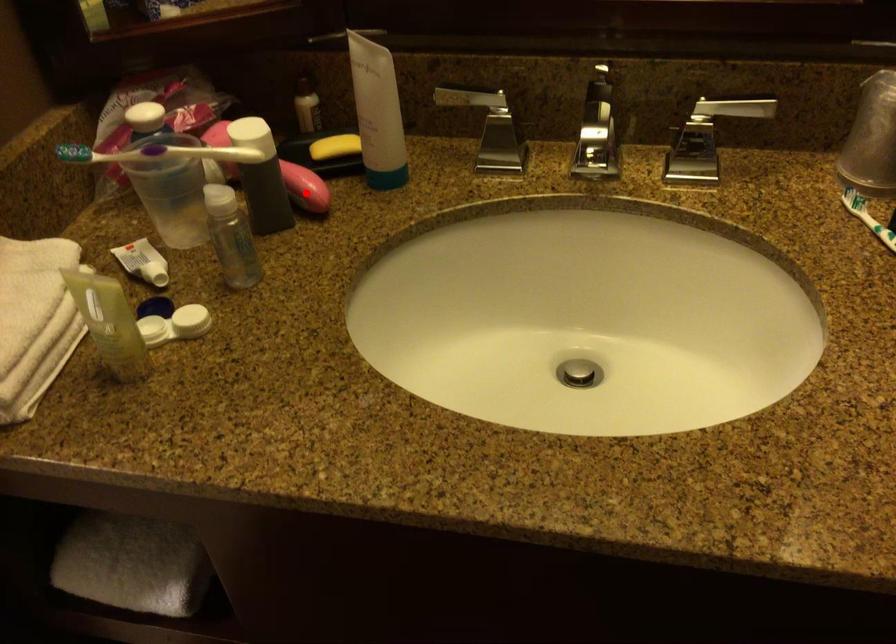
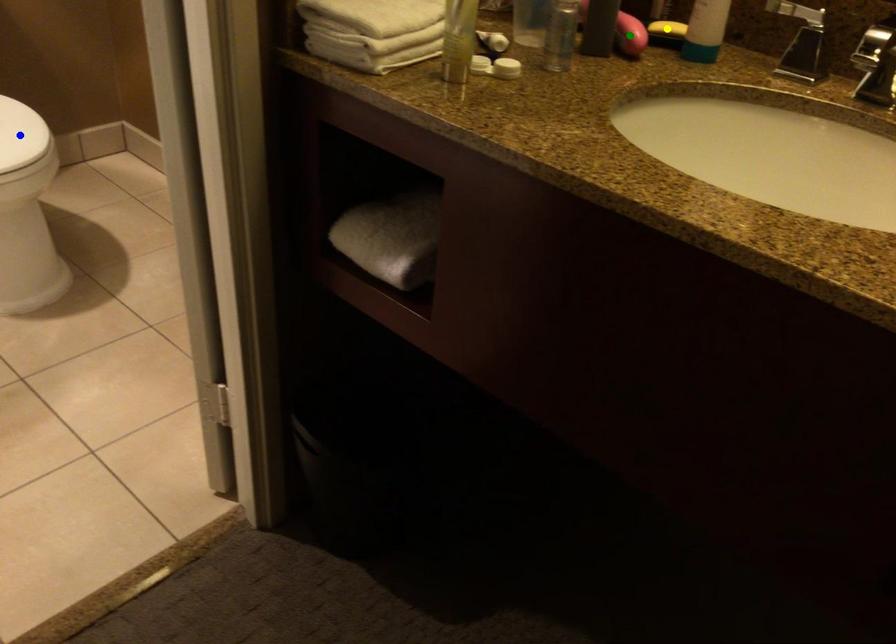
Question: I am providing you with two images of the same scene from different viewpoints. A red point is marked on the first image. You are given multiple points on the second image. Which point in image 2 is actually the same real-world point as the red point in image 1?

Choices:
 (A) yellow point
 (B) green point
 (C) blue point

Answer: (B)